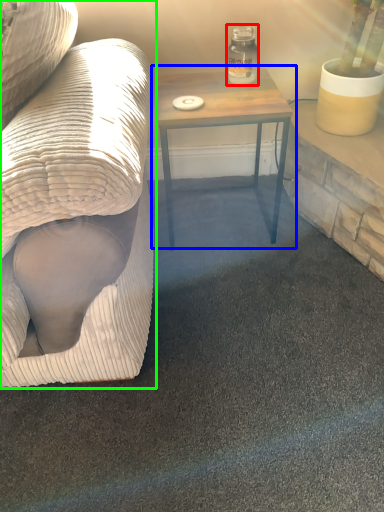
Question: Considering the real-world distances, which object is farthest from glass jar (highlighted by a red box)? table (highlighted by a blue box) or studio couch (highlighted by a green box)?

Choices:
 (A) table
 (B) studio couch

Answer: (B)